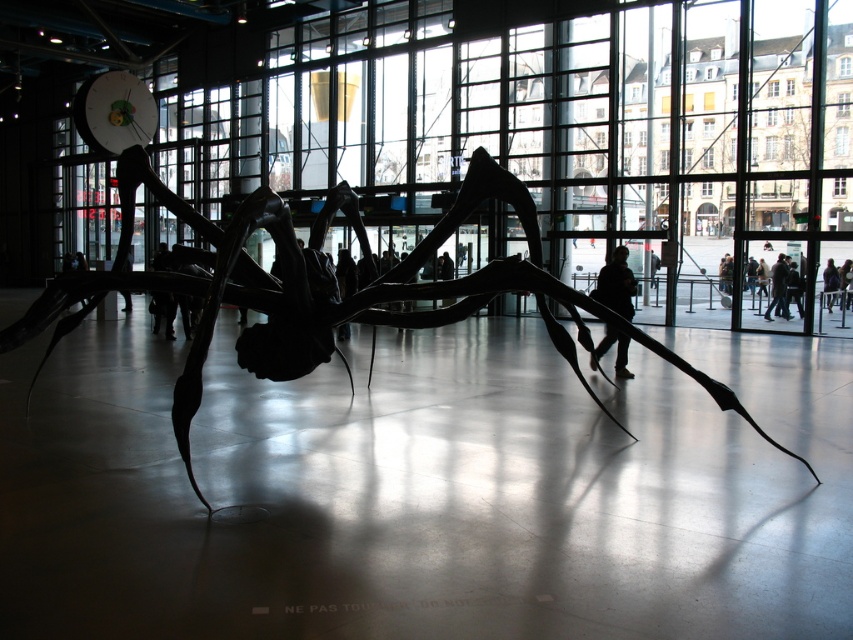
Is black matte jacket at center to the right of dark blue jeans at lower right from the viewer's perspective?

Incorrect, black matte jacket at center is not on the right side of dark blue jeans at lower right.

Is point (621, 256) positioned before point (773, 276)?

Yes, it is in front of point (773, 276).

The height and width of the screenshot is (640, 853). Identify the location of black matte jacket at center. (616, 284).

Is black matte spider at center smaller than black matte jacket at center?

No, black matte spider at center is not smaller than black matte jacket at center.

Find the location of `black matte spider at center`. black matte spider at center is located at coordinates (329, 300).

Where is `black matte spider at center`? This screenshot has width=853, height=640. black matte spider at center is located at coordinates (329, 300).

Based on the photo, how far apart are black matte spider at center and dark hair at center?

52.05 feet

Consider the image. Between black matte spider at center and dark hair at center, which one has less height?

black matte spider at center is shorter.

Is point (461, 282) in front of point (822, 276)?

That is True.

Find the location of a particular element. black matte spider at center is located at coordinates (329, 300).